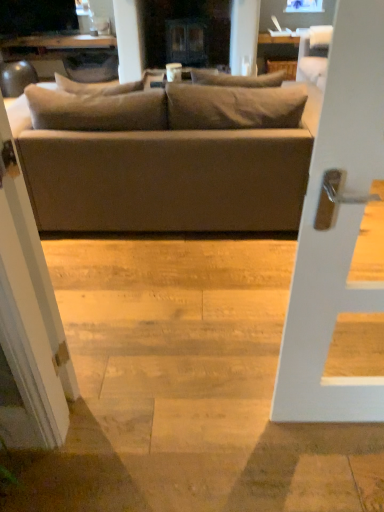
Locate an element on the screen. This screenshot has width=384, height=512. vacant area to the right of white glossy screen door at left is located at coordinates (106, 388).